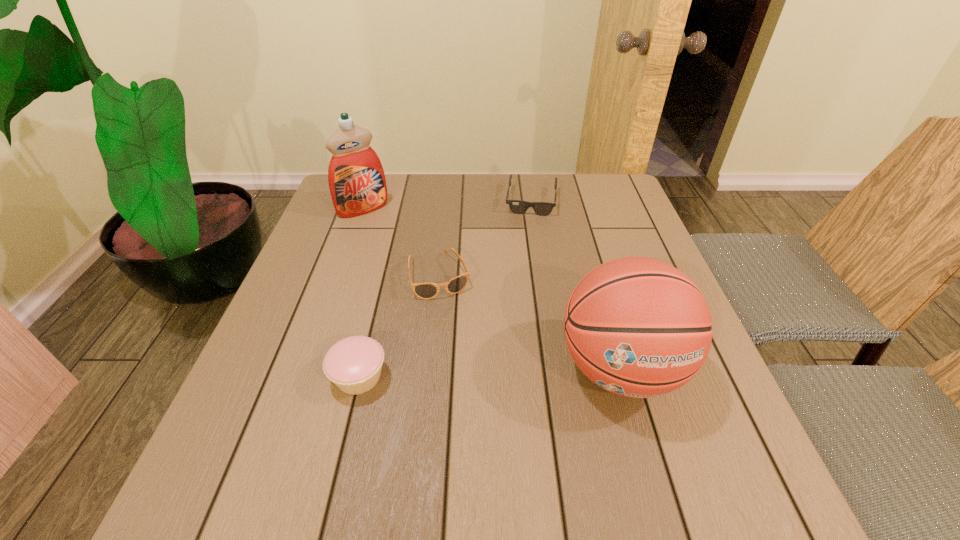
Where is `detergent that is at the left edge`? detergent that is at the left edge is located at coordinates (356, 178).

I want to click on object that is positioned at the right edge, so click(x=638, y=327).

Identify the location of object present at the far left corner. Image resolution: width=960 pixels, height=540 pixels. (356, 178).

This screenshot has height=540, width=960. I want to click on object that is at the near right corner, so click(638, 327).

The image size is (960, 540). I want to click on vacant space at the far edge of the desktop, so click(419, 211).

Locate an element on the screen. The width and height of the screenshot is (960, 540). vacant space at the left edge is located at coordinates (300, 340).

Locate an element on the screen. This screenshot has height=540, width=960. free space at the right edge of the desktop is located at coordinates (615, 218).

Where is `vacant space at the near left corner`? This screenshot has width=960, height=540. vacant space at the near left corner is located at coordinates (276, 436).

You are a GUI agent. You are given a task and a screenshot of the screen. Output one action in this format:
    pyautogui.click(x=<x>, y=<y>)
    Task: Click on the free space between the detergent and the cupcake
    The image size is (960, 540).
    Given the screenshot: What is the action you would take?
    pyautogui.click(x=361, y=293)

Locate an element on the screen. Image resolution: width=960 pixels, height=540 pixels. free point between the third farthest object and the detergent is located at coordinates (401, 242).